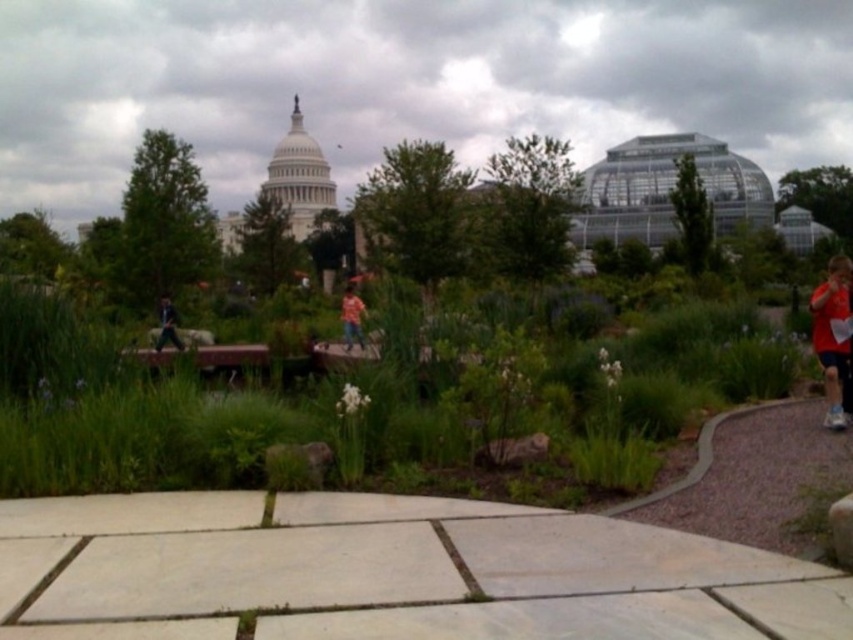
Question: Is red fabric shirt at right wider than black fabric jacket at lower left?

Choices:
 (A) yes
 (B) no

Answer: (A)

Question: Which object appears farthest from the camera in this image?

Choices:
 (A) orange shirt at center
 (B) red fabric shirt at right
 (C) smooth concrete path at center

Answer: (A)

Question: Is green grassy area at center wider than orange shirt at center?

Choices:
 (A) yes
 (B) no

Answer: (A)

Question: Among these points, which one is farthest from the camera?

Choices:
 (A) (167, 324)
 (B) (354, 321)
 (C) (634, 547)
 (D) (19, 458)

Answer: (B)

Question: Which of the following is the closest to the observer?

Choices:
 (A) (164, 305)
 (B) (814, 307)
 (C) (790, 372)

Answer: (B)

Question: Does smooth concrete path at center have a lesser width compared to black fabric jacket at lower left?

Choices:
 (A) yes
 (B) no

Answer: (B)